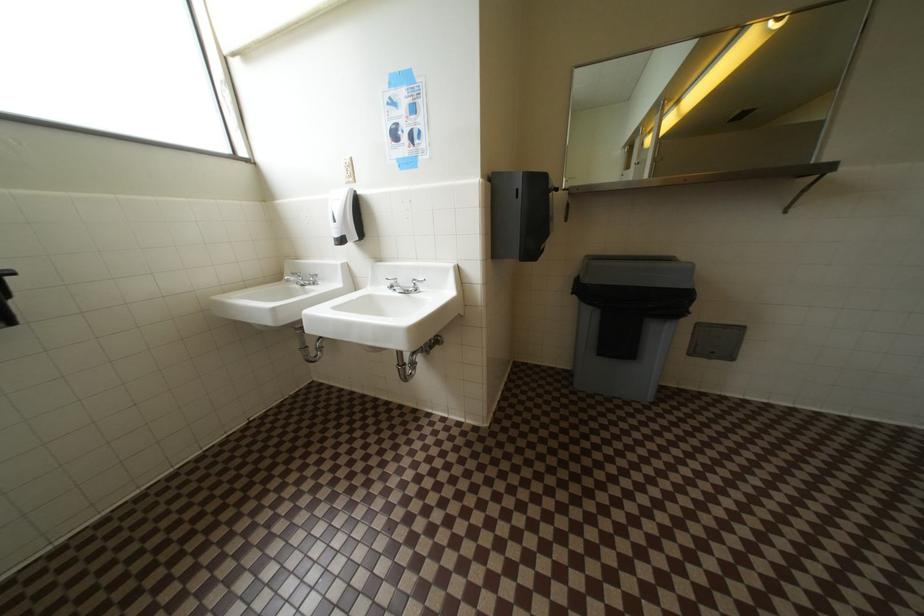
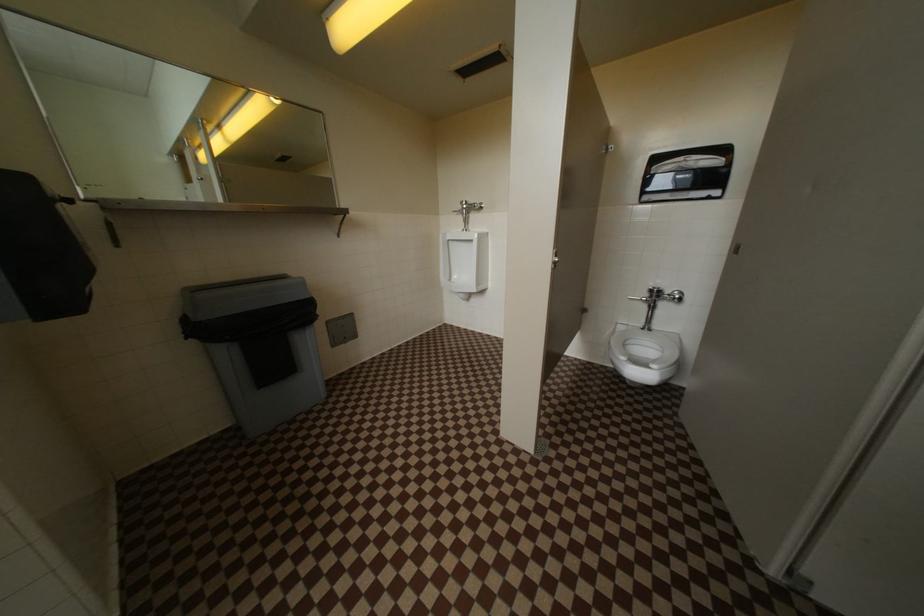
Question: The first image is from the beginning of the video and the second image is from the end. How did the camera likely rotate when shooting the video?

Choices:
 (A) Left
 (B) Right
 (C) Up
 (D) Down

Answer: (B)